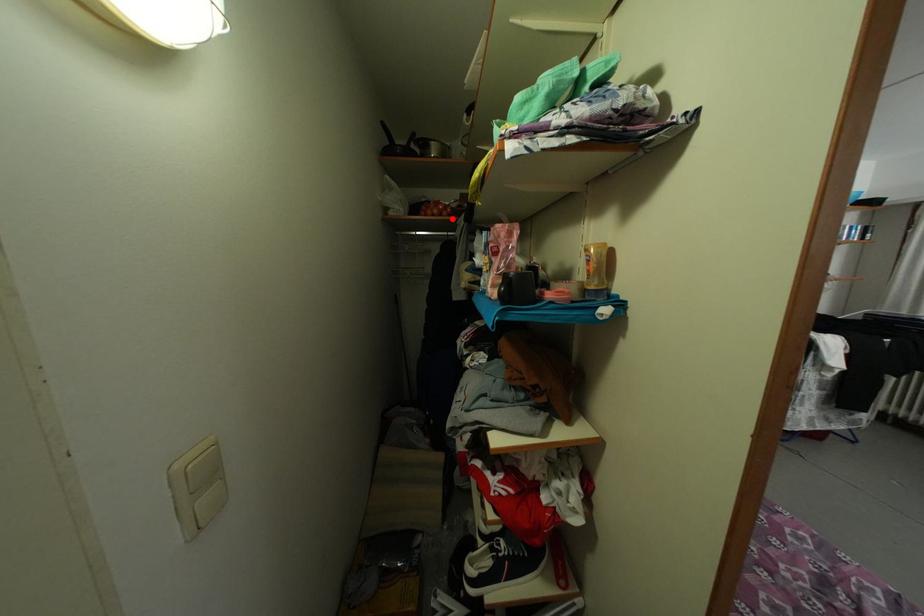
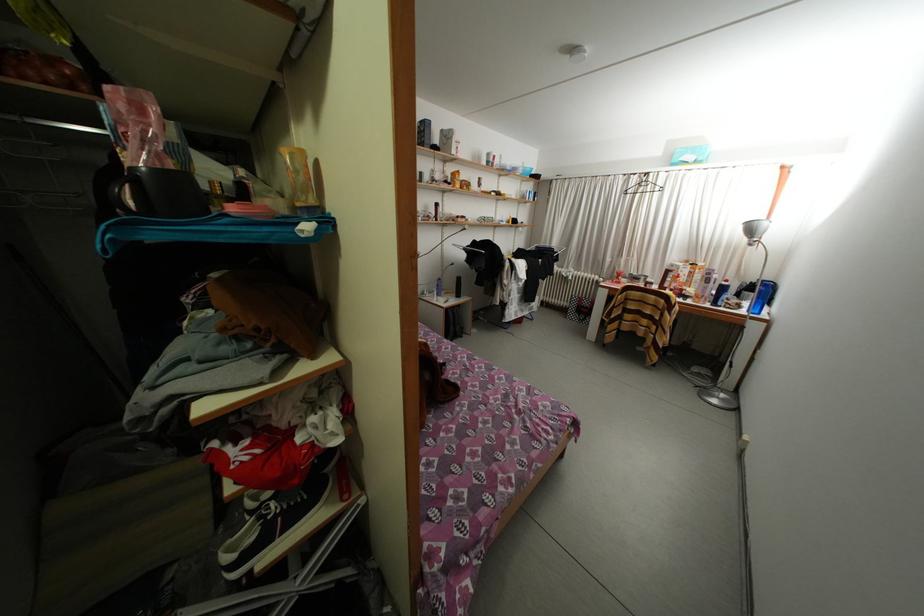
Question: I am providing you with two images of the same scene from different viewpoints. In image1, a red point is highlighted. Considering the same 3D point in image2, which of the following is correct?

Choices:
 (A) It is closer
 (B) It is farther

Answer: (B)